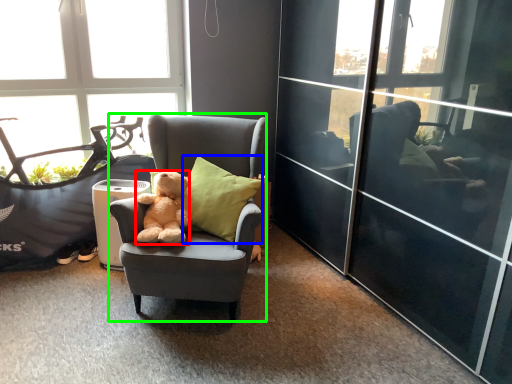
Question: Based on their relative distances, which object is farther from teddy bear (highlighted by a red box)? Choose from pillow (highlighted by a blue box) and chair (highlighted by a green box).

Choices:
 (A) pillow
 (B) chair

Answer: (B)